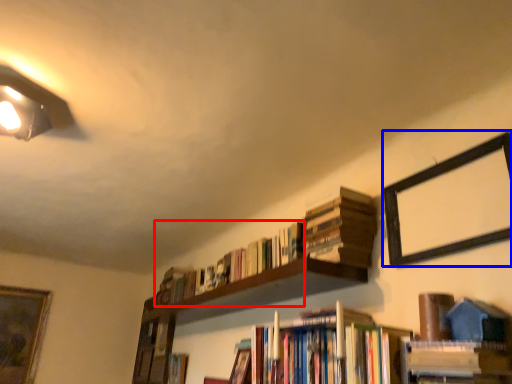
Question: Which object is closer to the camera taking this photo, book (highlighted by a red box) or picture frame (highlighted by a blue box)?

Choices:
 (A) book
 (B) picture frame

Answer: (B)